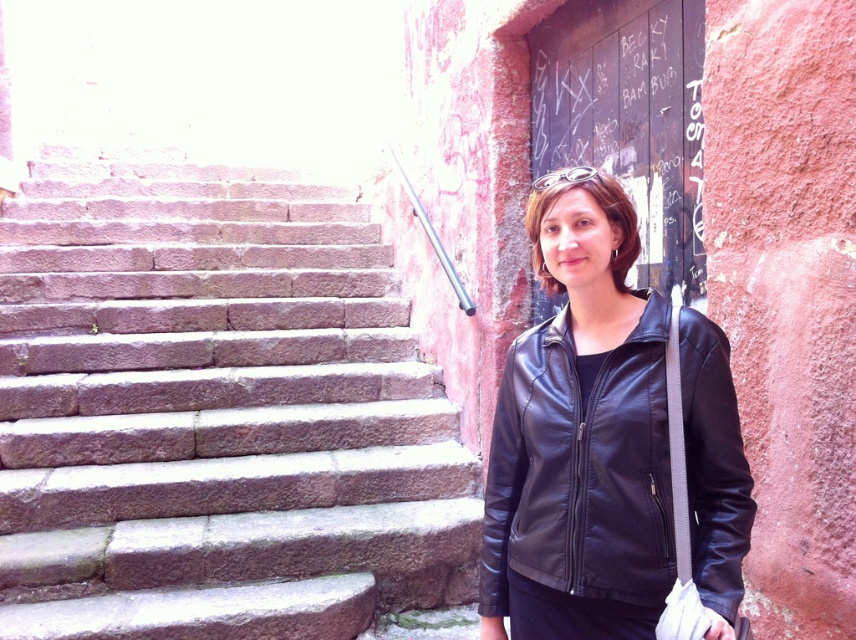
Question: Where is brown stone stairs at left located in relation to black leather jacket at right in the image?

Choices:
 (A) right
 (B) left

Answer: (B)

Question: Which point is farther to the camera?

Choices:
 (A) (447, 589)
 (B) (640, 512)

Answer: (A)

Question: Can you confirm if brown stone stairs at left is smaller than black leather jacket at right?

Choices:
 (A) no
 (B) yes

Answer: (A)

Question: Is brown stone stairs at left behind black leather jacket at right?

Choices:
 (A) no
 (B) yes

Answer: (B)